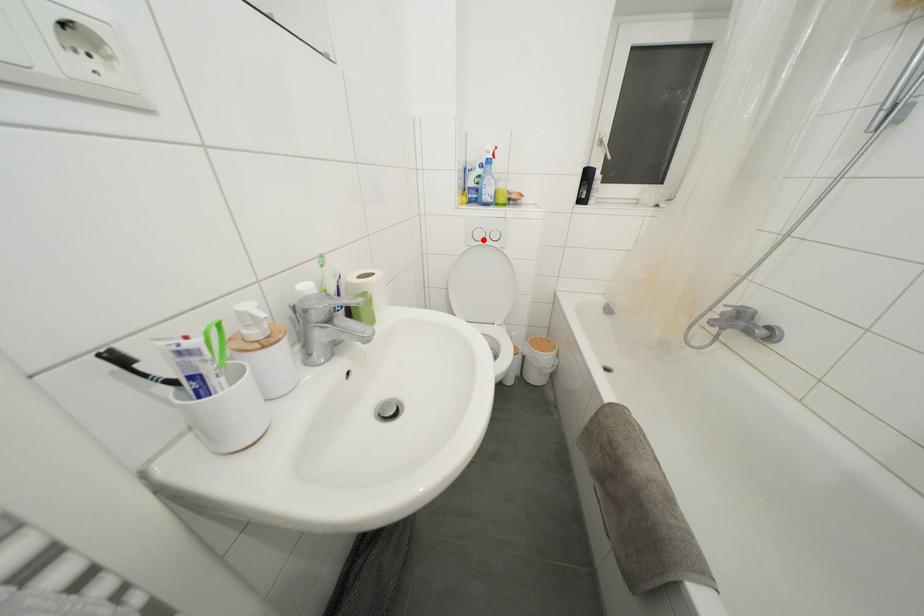
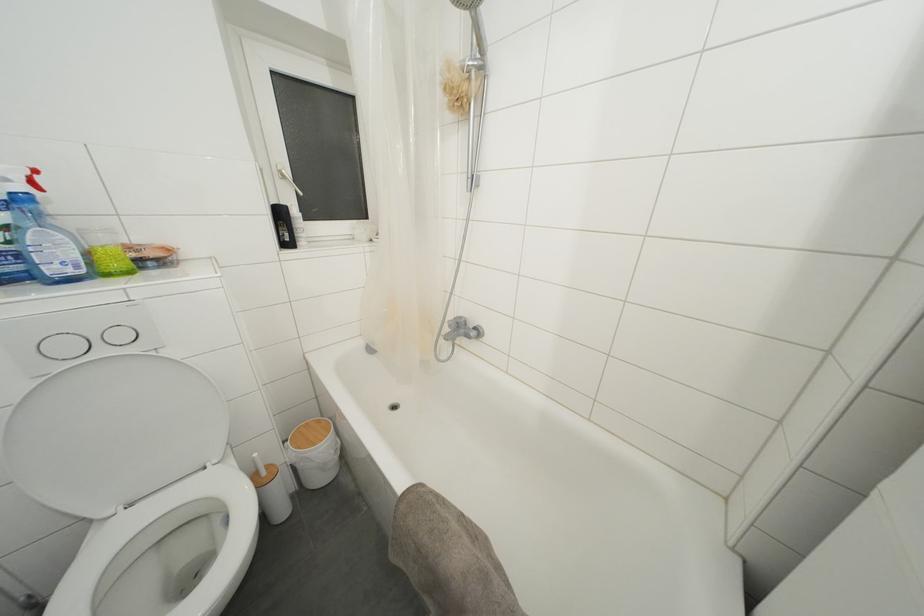
The point at the highlighted location is marked in the first image. Where is the corresponding point in the second image?

(71, 352)